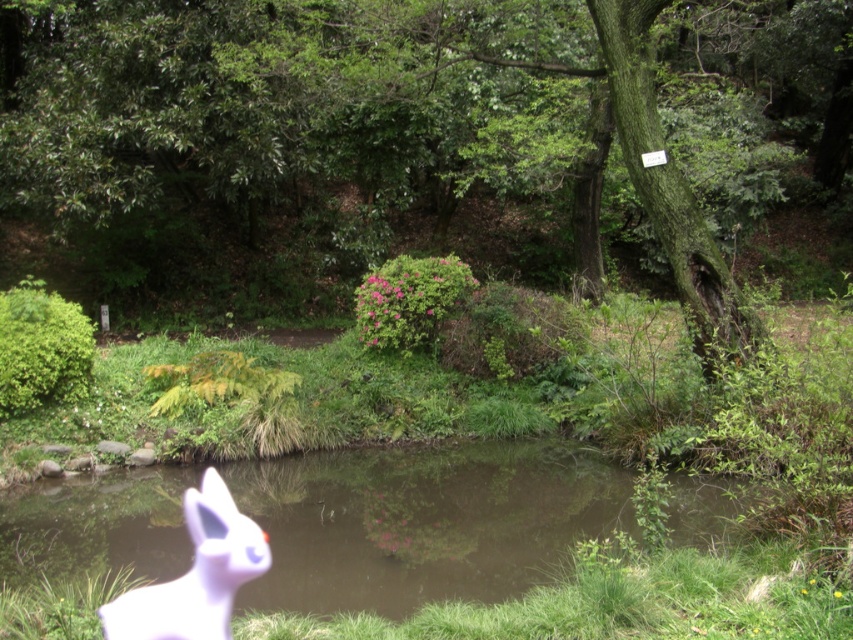
Looking at this image, is transparent water at pond center behind purple matte rabbit at lower left?

Yes, it is.

Who is positioned more to the left, transparent water at pond center or purple matte rabbit at lower left?

From the viewer's perspective, transparent water at pond center appears more on the left side.

The height and width of the screenshot is (640, 853). Identify the location of transparent water at pond center. (424, 522).

You are a GUI agent. You are given a task and a screenshot of the screen. Output one action in this format:
    pyautogui.click(x=<x>, y=<y>)
    Task: Click on the transparent water at pond center
    The image size is (853, 640).
    Given the screenshot: What is the action you would take?
    pyautogui.click(x=424, y=522)